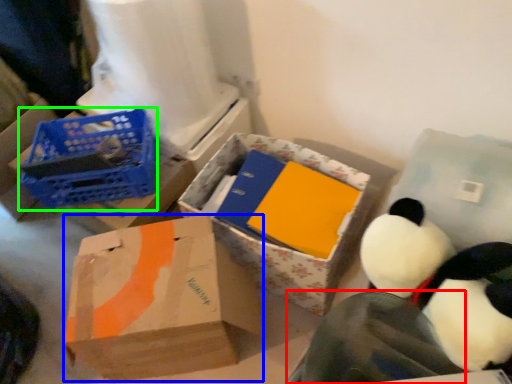
Question: Which is farther away from penguin (highlighted by a red box)? box (highlighted by a blue box) or basket (highlighted by a green box)?

Choices:
 (A) box
 (B) basket

Answer: (B)